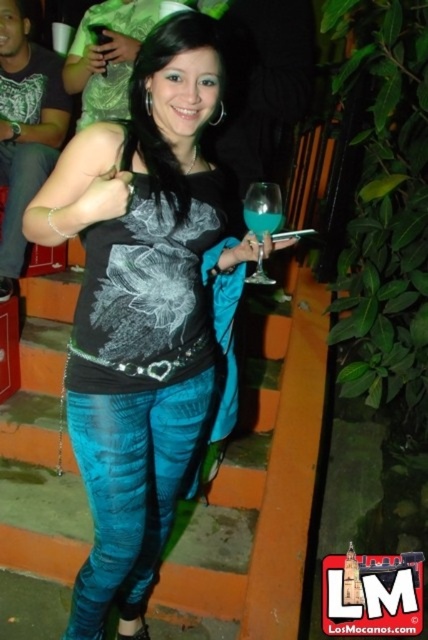
Between matte black tank top at center and translucent blue glass at center, which one appears on the right side from the viewer's perspective?

From the viewer's perspective, translucent blue glass at center appears more on the right side.

Between matte black tank top at center and translucent blue glass at center, which one is positioned lower?

matte black tank top at center

What do you see at coordinates (139, 308) in the screenshot? The image size is (428, 640). I see `matte black tank top at center` at bounding box center [139, 308].

You are a GUI agent. You are given a task and a screenshot of the screen. Output one action in this format:
    pyautogui.click(x=<x>, y=<y>)
    Task: Click on the matte black tank top at center
    This screenshot has height=640, width=428.
    Given the screenshot: What is the action you would take?
    pyautogui.click(x=139, y=308)

Can you confirm if matte black shirt at center is positioned above translucent blue glass at center?

Yes.

Can you confirm if matte black shirt at center is wider than translucent blue glass at center?

Correct, the width of matte black shirt at center exceeds that of translucent blue glass at center.

Describe the element at coordinates (107, 56) in the screenshot. I see `matte black shirt at center` at that location.

Image resolution: width=428 pixels, height=640 pixels. I want to click on matte black shirt at center, so click(107, 56).

Is matte black tank top at center to the right of translucent glass at center from the viewer's perspective?

Incorrect, matte black tank top at center is not on the right side of translucent glass at center.

Who is more forward, (98,522) or (264,220)?

Positioned in front is point (264,220).

The height and width of the screenshot is (640, 428). Find the location of `matte black tank top at center`. matte black tank top at center is located at coordinates (139, 308).

Identify the location of matte black tank top at center. (139, 308).